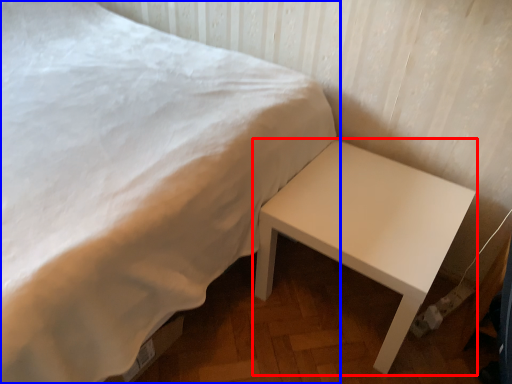
Question: Which object is closer to the camera taking this photo, table (highlighted by a red box) or bed (highlighted by a blue box)?

Choices:
 (A) table
 (B) bed

Answer: (B)